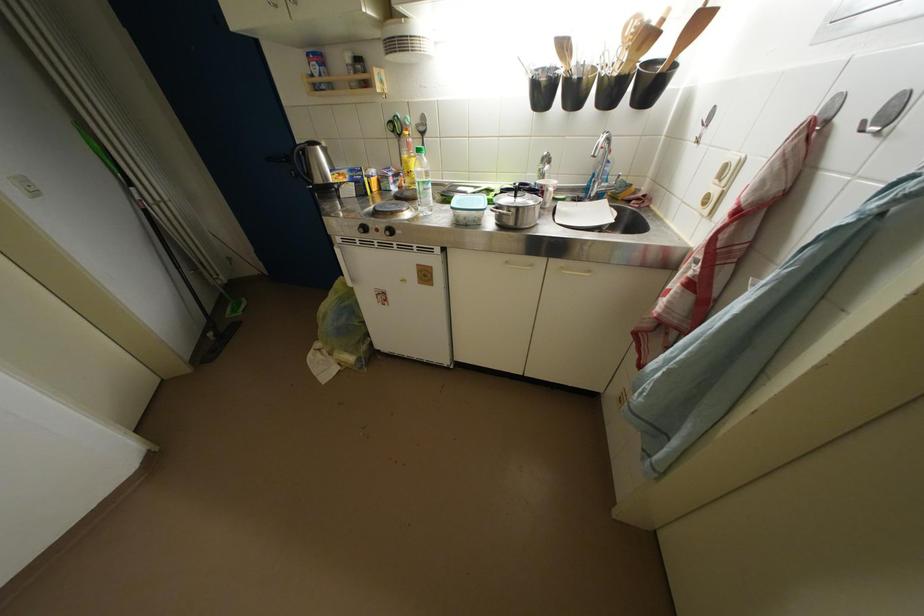
Find where to lift the pot lid handle. Please return your answer as a coordinate pair (x, y).

(516, 208)